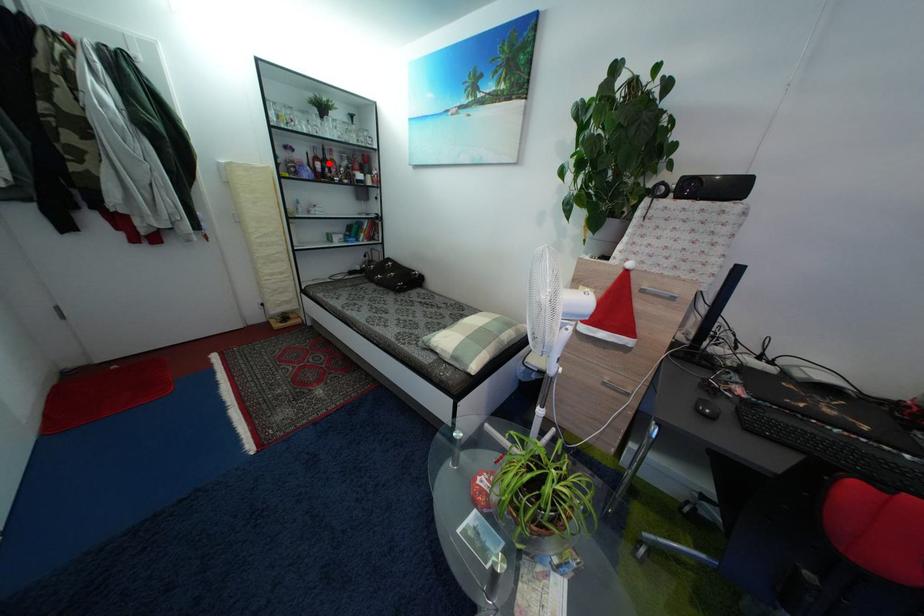
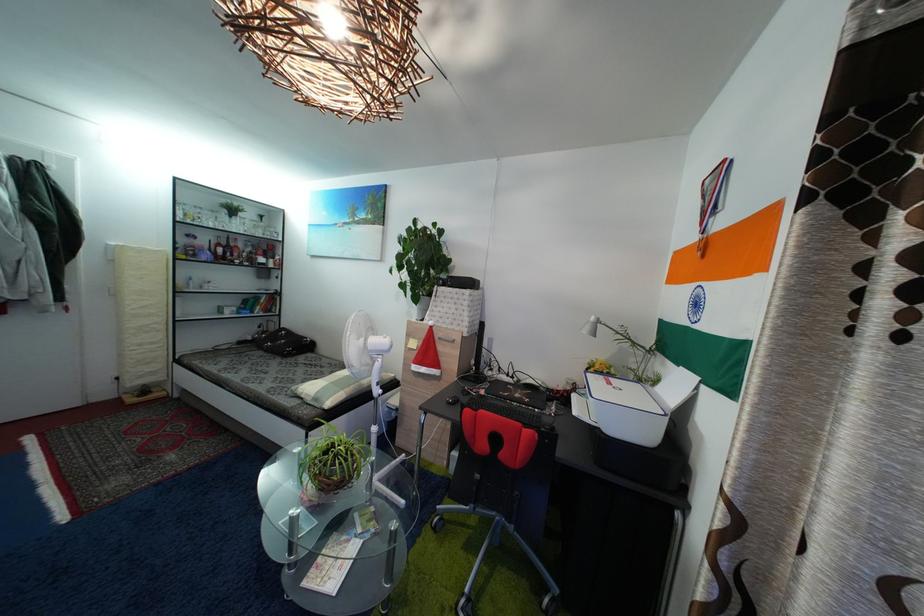
Locate, in the second image, the point that corresponds to the highlighted location in the first image.

(233, 251)